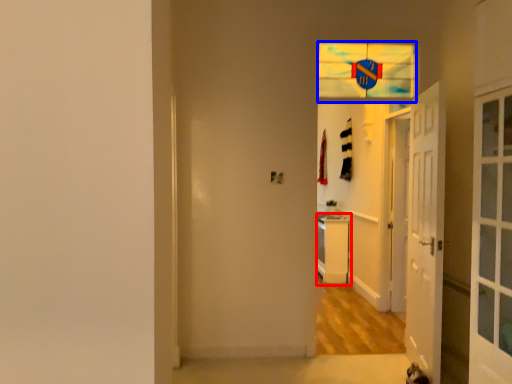
Question: Which of the following is the farthest to the observer, dresser (highlighted by a red box) or glass window (highlighted by a blue box)?

Choices:
 (A) dresser
 (B) glass window

Answer: (A)